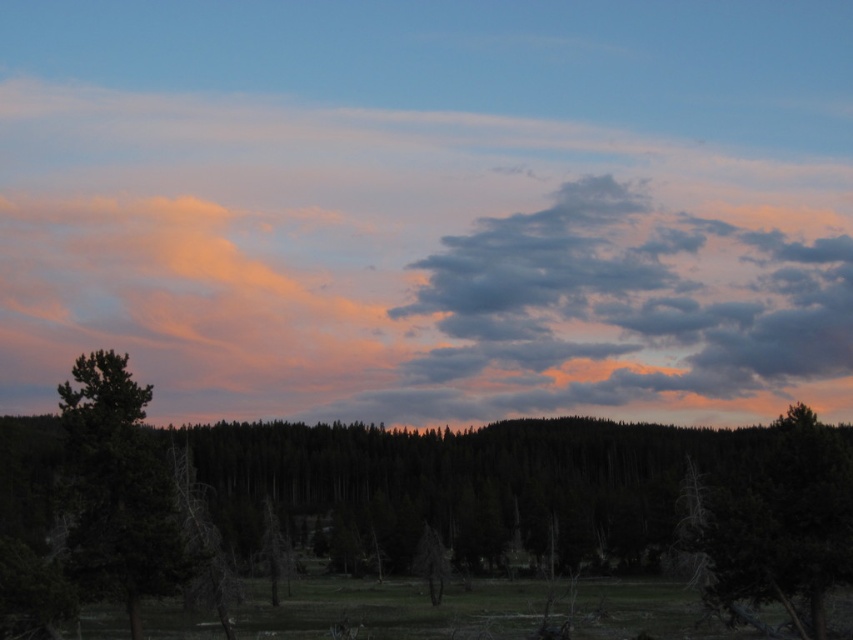
In the scene shown: You are an artist trying to paint the scene. You notice the pastel cotton clouds at center and the green matte tree at center. Which object should you paint first if you want to depict the larger one first?

The pastel cotton clouds at center has a larger size compared to the green matte tree at center, so you should paint the pastel cotton clouds at center first.

You are planning to build a treehouse and want to choose between the dark green forest at center and the green matte tree at center. Which one would be more suitable based on their height?

The dark green forest at center has a greater height compared to the green matte tree at center, so it would be more suitable for building a treehouse as it offers a taller structure.

You are an astronomer analyzing the image. You need to locate the pastel cotton clouds at center for your study. Where exactly are they positioned in the image?

The pastel cotton clouds at center are positioned at point (412, 262).